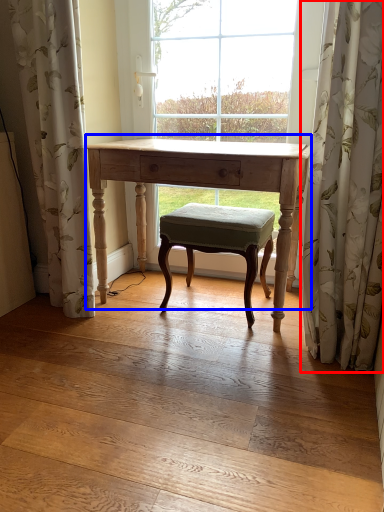
Question: Among these objects, which one is nearest to the camera, curtain (highlighted by a red box) or table (highlighted by a blue box)?

Choices:
 (A) curtain
 (B) table

Answer: (A)